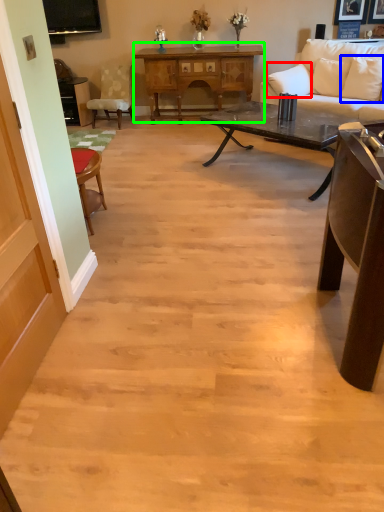
Question: Which is nearer to the pillow (highlighted by a red box)? pillow (highlighted by a blue box) or table (highlighted by a green box).

Choices:
 (A) pillow
 (B) table

Answer: (A)